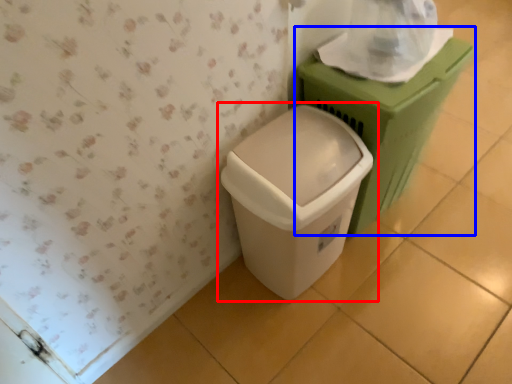
Question: Which object is further to the camera taking this photo, waste container (highlighted by a red box) or waste container (highlighted by a blue box)?

Choices:
 (A) waste container
 (B) waste container

Answer: (B)